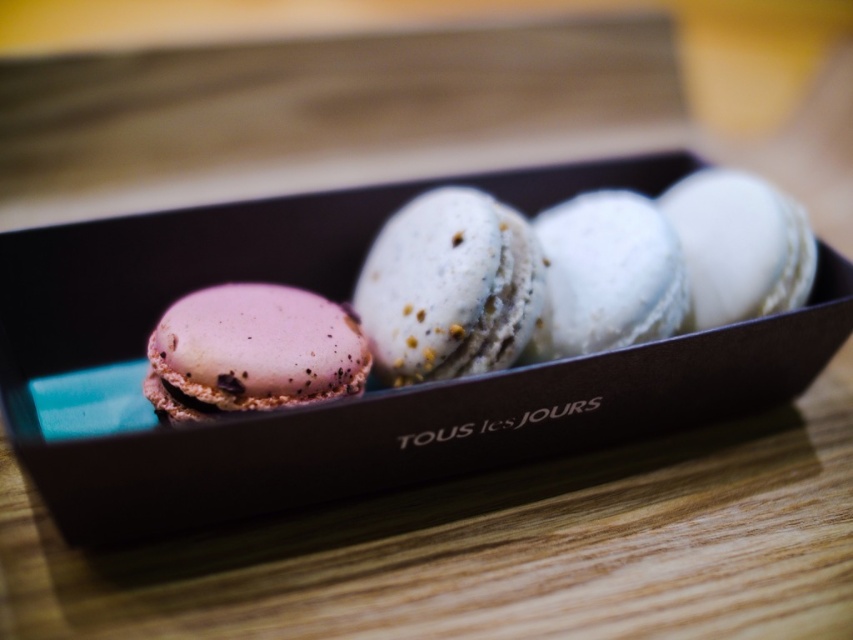
Question: Among these points, which one is farthest from the camera?

Choices:
 (A) (0, 400)
 (B) (323, 324)

Answer: (B)

Question: Observing the image, what is the correct spatial positioning of matte white macaron at center in reference to white textured macaron at center?

Choices:
 (A) below
 (B) above

Answer: (A)

Question: Can you confirm if pink matte macaron at left is positioned below white matte macaron at center?

Choices:
 (A) yes
 (B) no

Answer: (A)

Question: Is the position of matte black box at center less distant than that of white textured macaron at center?

Choices:
 (A) no
 (B) yes

Answer: (B)

Question: Estimate the real-world distances between objects in this image. Which object is farther from the white matte macaron at center?

Choices:
 (A) white textured macaron at center
 (B) matte white macaron at center
 (C) matte black box at center
 (D) pink matte macaron at left

Answer: (D)

Question: Which point is farther to the camera?

Choices:
 (A) pink matte macaron at left
 (B) matte black box at center
 (C) white textured macaron at center

Answer: (C)